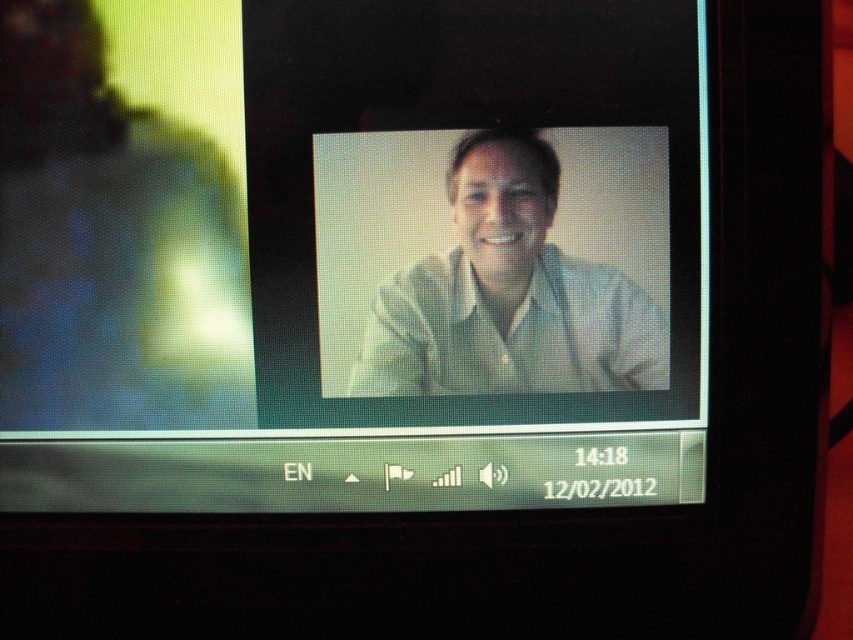
Is matte white monitor at center positioned in front of white matte shirt at center?

Yes, matte white monitor at center is closer to the viewer.

Can you confirm if matte white monitor at center is thinner than white matte shirt at center?

Incorrect, matte white monitor at center's width is not less than white matte shirt at center's.

This screenshot has width=853, height=640. Find the location of `matte white monitor at center`. matte white monitor at center is located at coordinates (358, 260).

The height and width of the screenshot is (640, 853). Identify the location of matte white monitor at center. (358, 260).